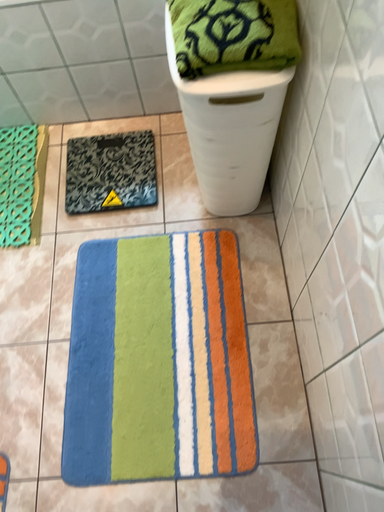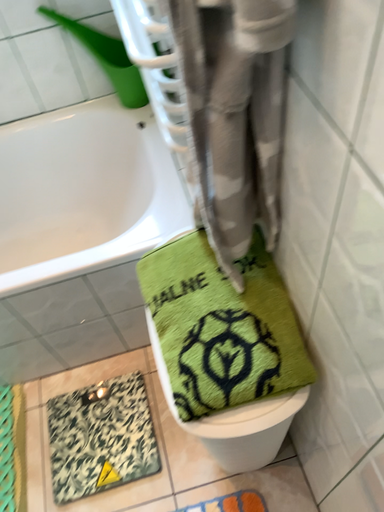
Question: How did the camera likely rotate when shooting the video?

Choices:
 (A) rotated downward
 (B) rotated upward

Answer: (B)